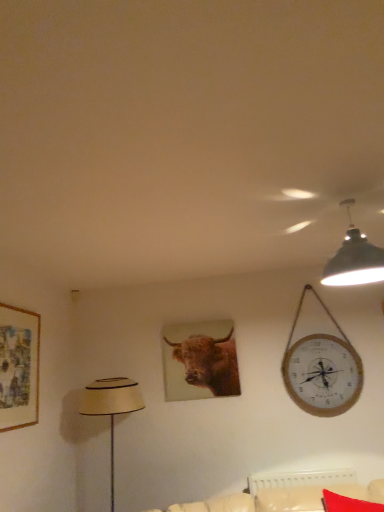
Image resolution: width=384 pixels, height=512 pixels. What do you see at coordinates (111, 407) in the screenshot?
I see `matte beige lampshade at left` at bounding box center [111, 407].

At what (x,y) coordinates should I click in order to perform the action: click on wooden picture frame at left. Please return your answer as a coordinate pair (x, y). This screenshot has width=384, height=512. Looking at the image, I should click on click(19, 367).

The width and height of the screenshot is (384, 512). I want to click on red fabric pillow at lower right, so click(347, 504).

At what (x,y) coordinates should I click in order to perform the action: click on brown matte/canvas at center. Please return your answer as a coordinate pair (x, y). Looking at the image, I should click on (200, 360).

Is matte beige lampshade at left turned away from wooden picture frame at left?

matte beige lampshade at left is not turned away from wooden picture frame at left.

Does matte beige lampshade at left appear on the left side of wooden picture frame at left?

No, matte beige lampshade at left is not to the left of wooden picture frame at left.

Based on the photo, from the image's perspective, who appears lower, matte beige lampshade at left or wooden picture frame at left?

From the image's view, matte beige lampshade at left is below.

Measure the distance between matte beige lampshade at left and wooden picture frame at left.

62.06 centimeters.

From the image's perspective, does matte beige lampshade at left appear higher than red fabric pillow at lower right?

Yes.

Are matte beige lampshade at left and red fabric pillow at lower right far apart?

Absolutely, matte beige lampshade at left is distant from red fabric pillow at lower right.

From a real-world perspective, which is physically below, matte beige lampshade at left or red fabric pillow at lower right?

red fabric pillow at lower right, from a real-world perspective.

Between matte beige lampshade at left and red fabric pillow at lower right, which one has smaller size?

With smaller size is red fabric pillow at lower right.

The width and height of the screenshot is (384, 512). Find the location of `table lamp lying on the left of black matte lampshade at upper right`. table lamp lying on the left of black matte lampshade at upper right is located at coordinates (111, 407).

Is point (336, 283) positioned in front of point (111, 401)?

Yes, point (336, 283) is in front of point (111, 401).

Which of these two, black matte lampshade at upper right or matte beige lampshade at left, is bigger?

matte beige lampshade at left.

Identify the location of pillow that is below the brown matte/canvas at center (from the image's perspective). Image resolution: width=384 pixels, height=512 pixels. 347,504.

Is red fabric pillow at lower right oriented towards brown matte/canvas at center?

No, red fabric pillow at lower right is not aimed at brown matte/canvas at center.

From the image's perspective, is red fabric pillow at lower right below brown matte/canvas at center?

Yes, from the image's perspective, red fabric pillow at lower right is below brown matte/canvas at center.

Which of these two, red fabric pillow at lower right or brown matte/canvas at center, stands shorter?

With less height is red fabric pillow at lower right.

Considering the points (189, 399) and (324, 280), which point is behind, point (189, 399) or point (324, 280)?

The point (189, 399) is behind.

Who is bigger, brown matte/canvas at center or black matte lampshade at upper right?

black matte lampshade at upper right is bigger.

Does brown matte/canvas at center touch black matte lampshade at upper right?

There is a gap between brown matte/canvas at center and black matte lampshade at upper right.

Based on the photo, measure the distance from brown matte/canvas at center to red fabric pillow at lower right.

The distance of brown matte/canvas at center from red fabric pillow at lower right is 4.16 feet.

Could you tell me if brown matte/canvas at center is facing red fabric pillow at lower right?

No, brown matte/canvas at center does not turn towards red fabric pillow at lower right.

Can you confirm if brown matte/canvas at center is positioned to the left of red fabric pillow at lower right?

Yes.

Considering the relative positions of black matte lampshade at upper right and red fabric pillow at lower right in the image provided, is black matte lampshade at upper right in front of red fabric pillow at lower right?

Yes.

In the scene shown: Which is correct: black matte lampshade at upper right is inside red fabric pillow at lower right, or outside of it?

black matte lampshade at upper right exists outside the volume of red fabric pillow at lower right.

Is black matte lampshade at upper right in contact with red fabric pillow at lower right?

No.

Where is `table lamp lying behind the wooden picture frame at left`? Image resolution: width=384 pixels, height=512 pixels. table lamp lying behind the wooden picture frame at left is located at coordinates (111, 407).

Locate an element on the screen. The width and height of the screenshot is (384, 512). pillow located below the matte beige lampshade at left (from the image's perspective) is located at coordinates (347, 504).

Considering their positions, is matte beige lampshade at left positioned closer to red fabric pillow at lower right than black matte lampshade at upper right?

The object closer to red fabric pillow at lower right is black matte lampshade at upper right.

From the image, which object appears to be farther from black matte lampshade at upper right, brown matte/canvas at center or red fabric pillow at lower right?

Among the two, red fabric pillow at lower right is located further to black matte lampshade at upper right.

Considering their positions, is matte beige lampshade at left positioned further to wooden picture frame at left than brown matte/canvas at center?

brown matte/canvas at center lies further to wooden picture frame at left than the other object.

Based on their spatial positions, is wooden picture frame at left or brown matte/canvas at center closer to red fabric pillow at lower right?

brown matte/canvas at center lies closer to red fabric pillow at lower right than the other object.

From the image, which object appears to be nearer to matte beige lampshade at left, wooden picture frame at left or red fabric pillow at lower right?

Among the two, wooden picture frame at left is located nearer to matte beige lampshade at left.

Which object lies further to the anchor point matte beige lampshade at left, brown matte/canvas at center or black matte lampshade at upper right?

Based on the image, black matte lampshade at upper right appears to be further to matte beige lampshade at left.

From the image, which object appears to be nearer to wooden picture frame at left, black matte lampshade at upper right or brown matte/canvas at center?

brown matte/canvas at center lies closer to wooden picture frame at left than the other object.

Looking at this image, estimate the real-world distances between objects in this image. Which object is further from matte beige lampshade at left, black matte lampshade at upper right or red fabric pillow at lower right?

Among the two, black matte lampshade at upper right is located further to matte beige lampshade at left.

Identify the location of cattle located between wooden picture frame at left and red fabric pillow at lower right in the left-right direction. Image resolution: width=384 pixels, height=512 pixels. (200, 360).

The height and width of the screenshot is (512, 384). I want to click on table lamp located between wooden picture frame at left and red fabric pillow at lower right in the left-right direction, so click(111, 407).

This screenshot has height=512, width=384. Find the location of `cattle between black matte lampshade at upper right and red fabric pillow at lower right in the up-down direction`. cattle between black matte lampshade at upper right and red fabric pillow at lower right in the up-down direction is located at coordinates (200, 360).

Find the location of a particular element. cattle situated between matte beige lampshade at left and red fabric pillow at lower right from left to right is located at coordinates (200, 360).